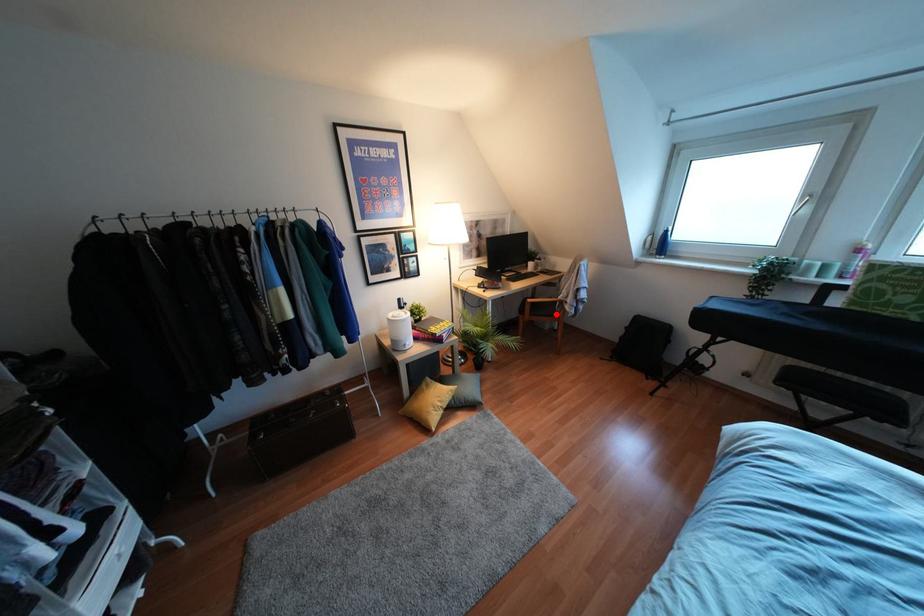
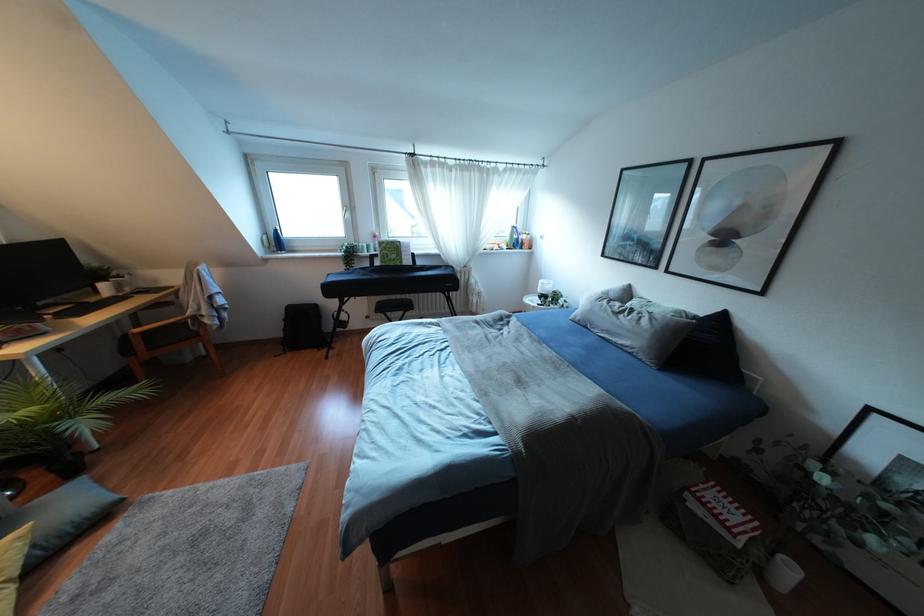
In the second image, find the point that corresponds to the highlighted location in the first image.

(196, 334)